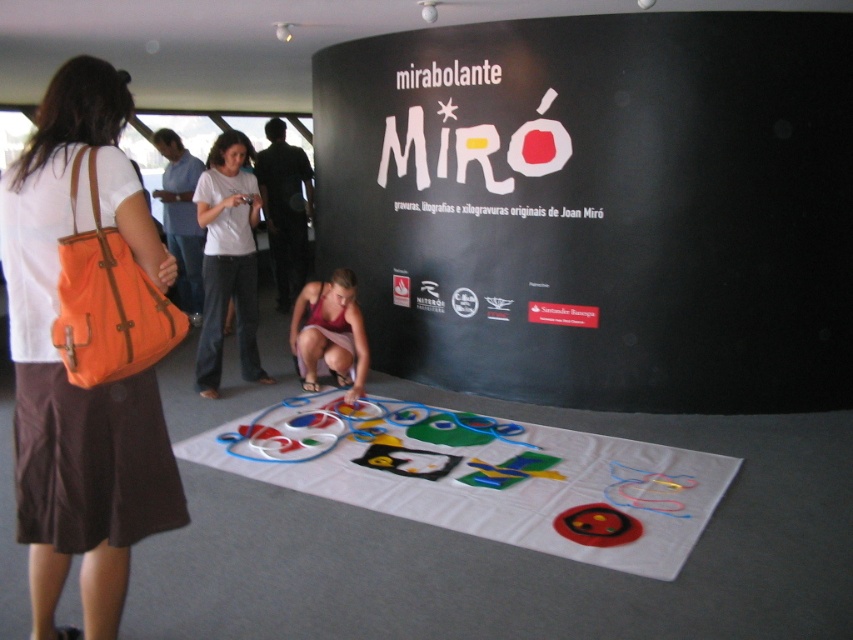
Question: From the image, what is the correct spatial relationship of orange fabric bag at left in relation to soft felt mat at center?

Choices:
 (A) right
 (B) left

Answer: (B)

Question: Estimate the real-world distances between objects in this image. Which object is farther from the pink fabric dress at center?

Choices:
 (A) white cotton shirt at center
 (B) soft felt mat at center

Answer: (B)

Question: Does white cotton shirt at center appear on the left side of pink fabric dress at center?

Choices:
 (A) no
 (B) yes

Answer: (B)

Question: Can you confirm if orange fabric bag at left is positioned to the right of soft felt mat at center?

Choices:
 (A) no
 (B) yes

Answer: (A)

Question: Among these objects, which one is farthest from the camera?

Choices:
 (A) soft felt mat at center
 (B) white cotton shirt at center
 (C) orange fabric bag at left

Answer: (B)

Question: Among these objects, which one is nearest to the camera?

Choices:
 (A) white cotton shirt at center
 (B) pink fabric dress at center

Answer: (A)